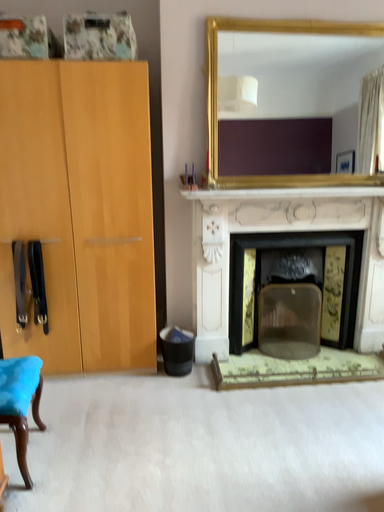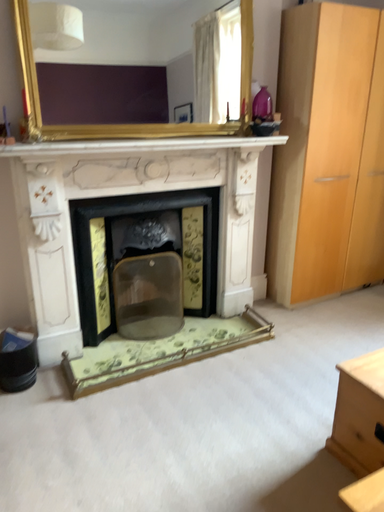
Question: Which way did the camera rotate in the video?

Choices:
 (A) rotated left
 (B) rotated right

Answer: (B)